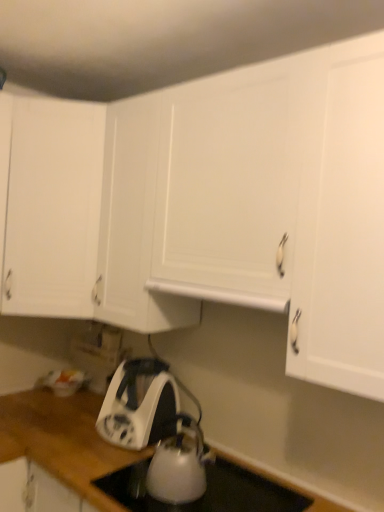
Question: From a real-world perspective, is white matte cabinet at upper left above or below white glossy kettle at lower center?

Choices:
 (A) below
 (B) above

Answer: (B)

Question: Is point (31, 240) closer or farther from the camera than point (294, 499)?

Choices:
 (A) closer
 (B) farther

Answer: (B)

Question: Which object is the closest to the white glossy electric kettle at lower center?

Choices:
 (A) white glossy kettle at lower center
 (B) white matte cabinet at upper left
 (C) white glossy kettle at lower center
 (D) white matte exhaust hood at center

Answer: (C)

Question: Which object is the closest to the white glossy kettle at lower center?

Choices:
 (A) white glossy kettle at lower center
 (B) white matte exhaust hood at center
 (C) white matte cabinet at upper left
 (D) white glossy electric kettle at lower center

Answer: (A)